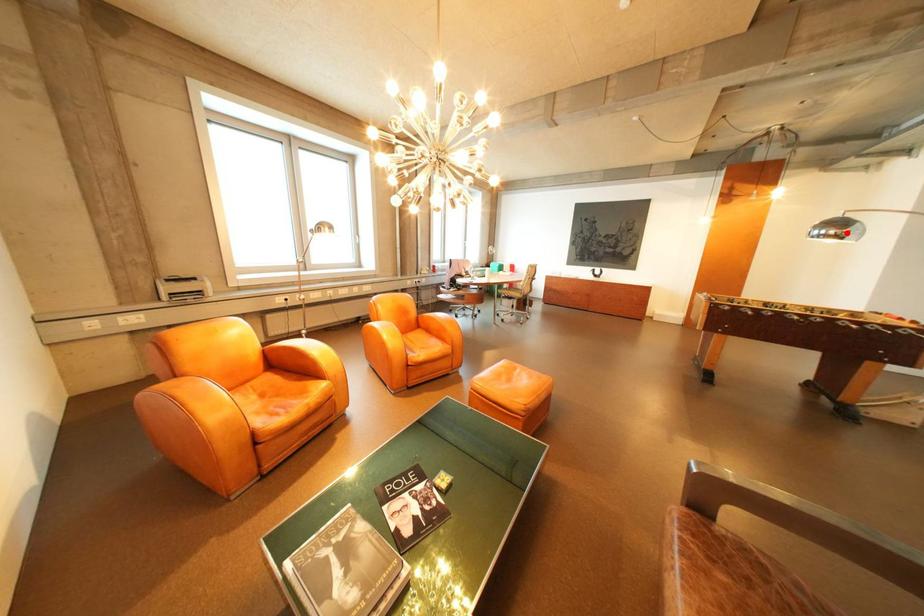
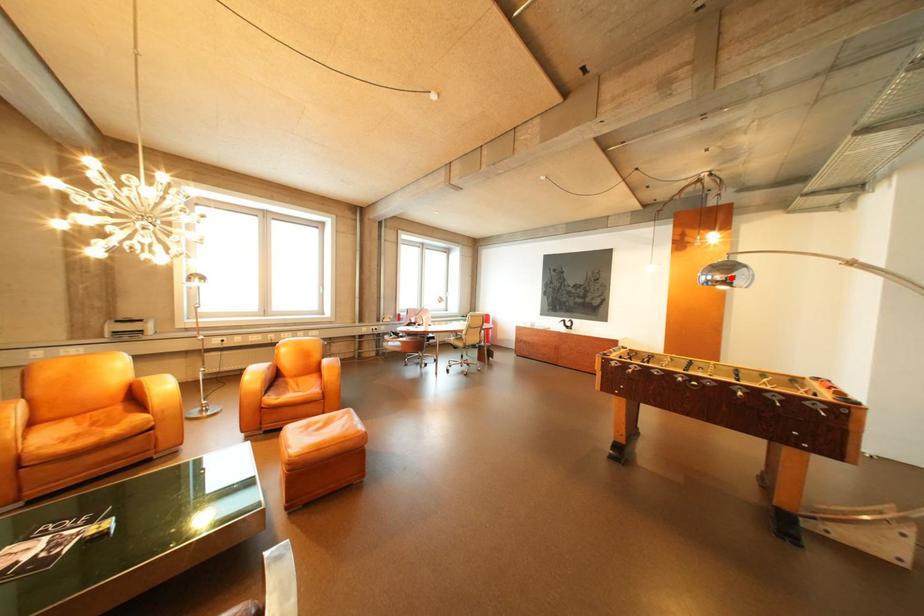
I am providing you with two images of the same scene from different viewpoints. A red point is marked on the first image and another point is marked on the second image. Is the red point in image1 aligned with the point shown in image2?

Yes